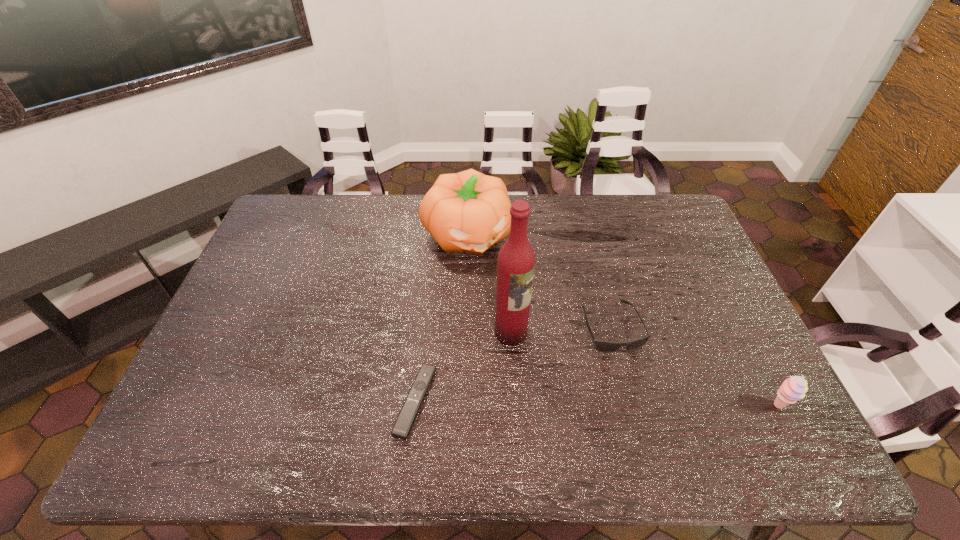
The height and width of the screenshot is (540, 960). I want to click on free space located on the carved face of the farthest object, so 491,277.

You are a GUI agent. You are given a task and a screenshot of the screen. Output one action in this format:
    pyautogui.click(x=<x>, y=<y>)
    Task: Click on the vacant space located on the carved face of the farthest object
    This screenshot has height=540, width=960.
    Given the screenshot: What is the action you would take?
    pyautogui.click(x=517, y=330)

Locate an element on the screen. The width and height of the screenshot is (960, 540). vacant space located on the carved face of the farthest object is located at coordinates (516, 327).

Where is `free space located 0.300m on the label of the liquor`? The height and width of the screenshot is (540, 960). free space located 0.300m on the label of the liquor is located at coordinates (617, 413).

In order to click on free region located on the label of the liquor in this screenshot , I will do `click(613, 410)`.

Find the location of a particular element. Image resolution: width=960 pixels, height=540 pixels. vacant space located on the label of the liquor is located at coordinates (580, 385).

Identify the location of vacant space situated 0.180m on the front-facing side of the sunglasses. 647,416.

The height and width of the screenshot is (540, 960). In order to click on vacant space located on the front-facing side of the sunglasses in this screenshot , I will do `click(629, 369)`.

Locate an element on the screen. free location located on the front-facing side of the sunglasses is located at coordinates (636, 387).

I want to click on object that is positioned at the far edge, so coord(468,211).